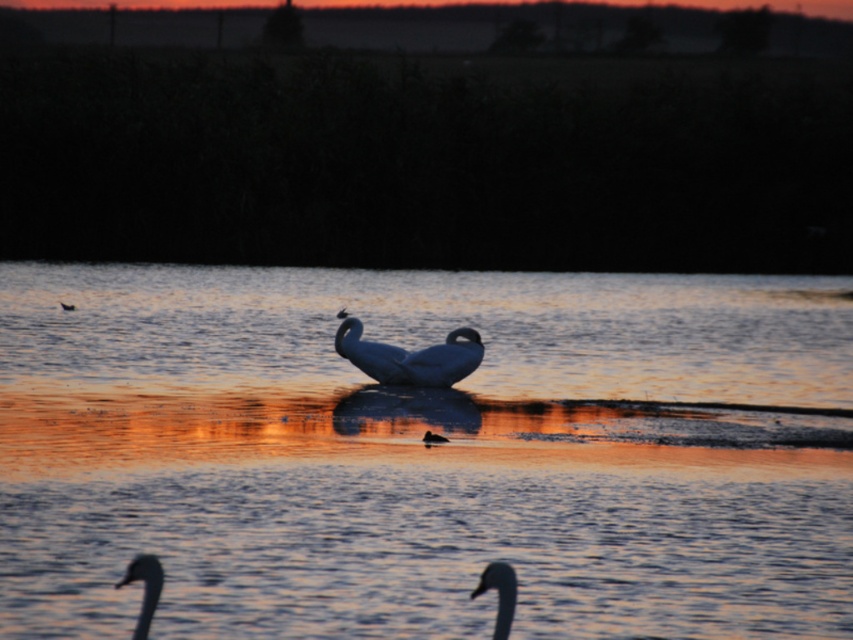
Question: Which object appears closest to the camera in this image?

Choices:
 (A) white glossy swan at center
 (B) white glossy swan at lower left

Answer: (B)

Question: Estimate the real-world distances between objects in this image. Which object is farther from the white glossy swan at center?

Choices:
 (A) white glossy swan at lower center
 (B) brown fuzzy duck at center
 (C) glistening water at center

Answer: (A)

Question: Which object is positioned closest to the white glossy swan at center?

Choices:
 (A) glistening water at center
 (B) brown fuzzy duck at center

Answer: (B)

Question: From the image, what is the correct spatial relationship of glistening water at center in relation to brown fuzzy duck at center?

Choices:
 (A) right
 (B) left

Answer: (B)

Question: Where is glistening water at center located in relation to white glossy swan at lower center in the image?

Choices:
 (A) above
 (B) below

Answer: (A)

Question: Observing the image, what is the correct spatial positioning of glistening water at center in reference to white glossy swan at center?

Choices:
 (A) above
 (B) below

Answer: (A)